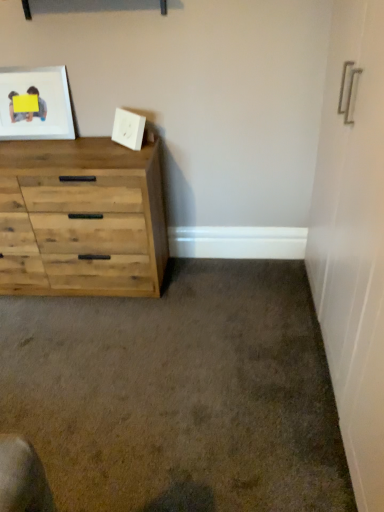
Question: Considering the positions of point (41, 112) and point (160, 247), is point (41, 112) closer or farther from the camera than point (160, 247)?

Choices:
 (A) farther
 (B) closer

Answer: (B)

Question: From the image's perspective, relative to natural wood chest of drawers at left, is matte wooden picture frame at upper left, marked as the 2th picture frame in a right-to-left arrangement, above or below?

Choices:
 (A) above
 (B) below

Answer: (A)

Question: Considering the real-world distances, which object is closest to the matte wooden picture frame at upper left, arranged as the first picture frame when viewed from the left?

Choices:
 (A) white matte picture frame at upper center, which ranks as the 2th picture frame in left-to-right order
 (B) natural wood chest of drawers at left

Answer: (B)

Question: Based on their relative distances, which object is nearer to the natural wood chest of drawers at left?

Choices:
 (A) matte wooden picture frame at upper left, arranged as the first picture frame when viewed from the left
 (B) white matte picture frame at upper center, which is counted as the 1th picture frame, starting from the right

Answer: (A)